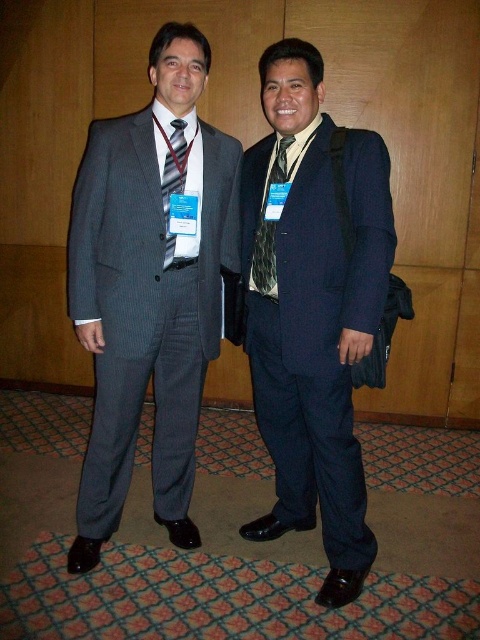
Question: Can you confirm if patterned silk tie at center is smaller than striped fabric tie at center?

Choices:
 (A) no
 (B) yes

Answer: (A)

Question: Which object is the farthest from the patterned silk tie at center?

Choices:
 (A) gray pinstripe suit at left
 (B) navy blue suit at center
 (C) striped fabric tie at center

Answer: (A)

Question: Is patterned silk tie at center to the right of striped fabric tie at center from the viewer's perspective?

Choices:
 (A) yes
 (B) no

Answer: (A)

Question: Which of the following is the closest to the observer?

Choices:
 (A) (325, 173)
 (B) (182, 182)
 (C) (263, 236)

Answer: (A)

Question: Does gray pinstripe suit at left come in front of navy blue suit at center?

Choices:
 (A) no
 (B) yes

Answer: (A)

Question: Based on their relative distances, which object is nearer to the gray pinstripe suit at left?

Choices:
 (A) striped fabric tie at center
 (B) navy blue suit at center

Answer: (A)